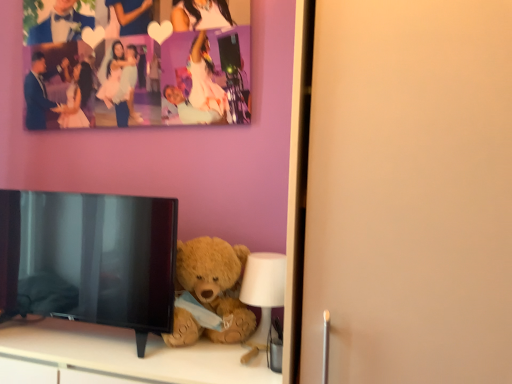
The width and height of the screenshot is (512, 384). Identify the location of free spot below black glossy tv at lower left (from a real-world perspective). (73, 344).